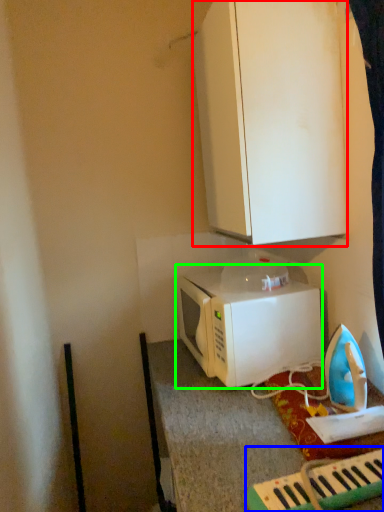
Question: Considering the real-world distances, which object is closest to cabinetry (highlighted by a red box)? musical keyboard (highlighted by a blue box) or microwave oven (highlighted by a green box).

Choices:
 (A) musical keyboard
 (B) microwave oven

Answer: (B)